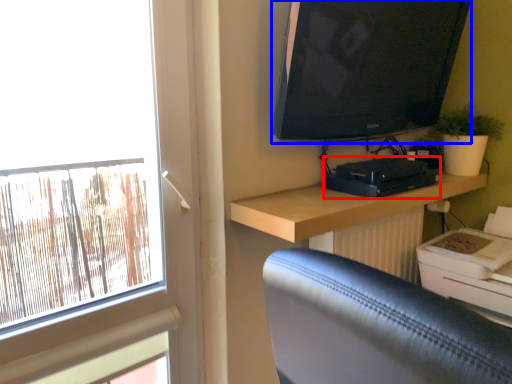
Question: Which object is closer to the camera taking this photo, equipment (highlighted by a red box) or television (highlighted by a blue box)?

Choices:
 (A) equipment
 (B) television

Answer: (B)